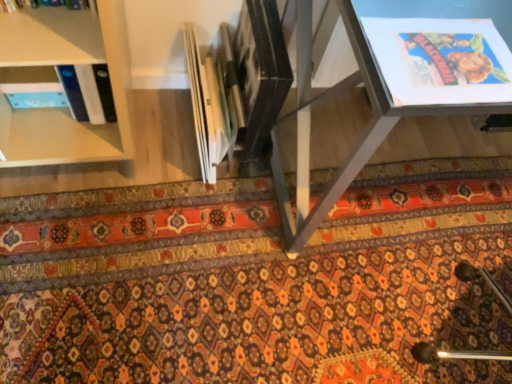
What is the approximate width of metallic gray table at center?

It is 63.22 centimeters.

Identify the location of metallic gray table at center. The image size is (512, 384). (409, 77).

What do you see at coordinates (409, 77) in the screenshot? I see `metallic gray table at center` at bounding box center [409, 77].

What is the approximate height of carpeted mat at center?

The height of carpeted mat at center is 2.81 centimeters.

The height and width of the screenshot is (384, 512). What do you see at coordinates (256, 281) in the screenshot?
I see `carpeted mat at center` at bounding box center [256, 281].

Measure the distance between point (x=169, y=303) and camera.

The depth of point (x=169, y=303) is 4.11 feet.

Identify the location of carpeted mat at center. (256, 281).

Locate an element on the screen. The image size is (512, 384). metallic gray table at center is located at coordinates (409, 77).

Considering the relative positions of carpeted mat at center and metallic gray table at center in the image provided, is carpeted mat at center to the right of metallic gray table at center from the viewer's perspective?

No, carpeted mat at center is not to the right of metallic gray table at center.

Is carpeted mat at center closer to camera compared to metallic gray table at center?

No, it is not.

Is point (208, 239) behind point (485, 92)?

Yes, it is.

From the image's perspective, is carpeted mat at center on top of metallic gray table at center?

Actually, carpeted mat at center appears below metallic gray table at center in the image.

From a real-world perspective, is carpeted mat at center physically located above or below metallic gray table at center?

From a real-world perspective, carpeted mat at center is physically below metallic gray table at center.

Which object is wider, carpeted mat at center or metallic gray table at center?

carpeted mat at center.

Consider the image. Is carpeted mat at center taller than metallic gray table at center?

In fact, carpeted mat at center may be shorter than metallic gray table at center.

Can you confirm if carpeted mat at center is smaller than metallic gray table at center?

Yes.

Is carpeted mat at center inside the boundaries of metallic gray table at center, or outside?

carpeted mat at center is not enclosed by metallic gray table at center.

Is carpeted mat at center next to metallic gray table at center and touching it?

They are not placed beside each other.

Could you tell me if carpeted mat at center is turned towards metallic gray table at center?

No, carpeted mat at center does not turn towards metallic gray table at center.

The width and height of the screenshot is (512, 384). What are the coordinates of `table located above the carpeted mat at center (from the image's perspective)` in the screenshot? It's located at (409, 77).

Between metallic gray table at center and carpeted mat at center, which one appears on the left side from the viewer's perspective?

From the viewer's perspective, carpeted mat at center appears more on the left side.

Relative to carpeted mat at center, is metallic gray table at center in front or behind?

Visually, metallic gray table at center is located in front of carpeted mat at center.

Consider the image. Which point is more distant from viewer, [367,82] or [206,308]?

The point [206,308] is more distant.

From the image's perspective, which object appears higher, metallic gray table at center or carpeted mat at center?

metallic gray table at center.

Looking at this image, from a real-world perspective, is metallic gray table at center positioned above or below carpeted mat at center?

metallic gray table at center is above carpeted mat at center.

Does metallic gray table at center have a lesser width compared to carpeted mat at center?

Indeed, metallic gray table at center has a lesser width compared to carpeted mat at center.

Is metallic gray table at center shorter than carpeted mat at center?

Incorrect, the height of metallic gray table at center does not fall short of that of carpeted mat at center.

Which of these two, metallic gray table at center or carpeted mat at center, is smaller?

carpeted mat at center is smaller.

Is metallic gray table at center inside the boundaries of carpeted mat at center, or outside?

metallic gray table at center is located beyond the bounds of carpeted mat at center.

Is metallic gray table at center placed right next to carpeted mat at center?

No, metallic gray table at center is not beside carpeted mat at center.

Is metallic gray table at center oriented away from carpeted mat at center?

No.

From the picture: What's the angular difference between metallic gray table at center and carpeted mat at center's facing directions?

The angle between the facing direction of metallic gray table at center and the facing direction of carpeted mat at center is 0.772 degrees.

This screenshot has width=512, height=384. In order to click on mat on the left of metallic gray table at center in this screenshot , I will do coord(256,281).

This screenshot has width=512, height=384. What are the coordinates of `mat that is under the metallic gray table at center (from a real-world perspective)` in the screenshot? It's located at (256, 281).

Locate an element on the screen. mat that is behind the metallic gray table at center is located at coordinates (256, 281).